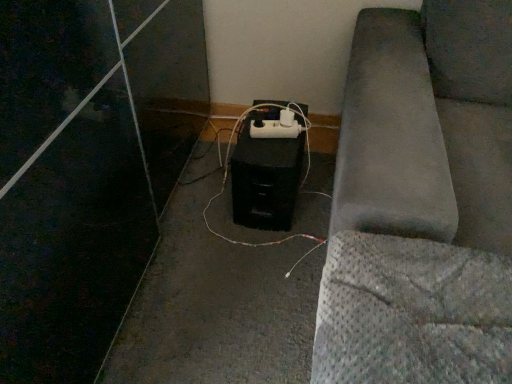
Image resolution: width=512 pixels, height=384 pixels. What are the coordinates of `black plastic computer tower at center` in the screenshot? It's located at (265, 175).

The width and height of the screenshot is (512, 384). What do you see at coordinates (265, 175) in the screenshot? I see `black plastic computer tower at center` at bounding box center [265, 175].

At what (x,y) coordinates should I click in order to perform the action: click on black plastic computer tower at center. Please return your answer as a coordinate pair (x, y). The width and height of the screenshot is (512, 384). Looking at the image, I should click on (265, 175).